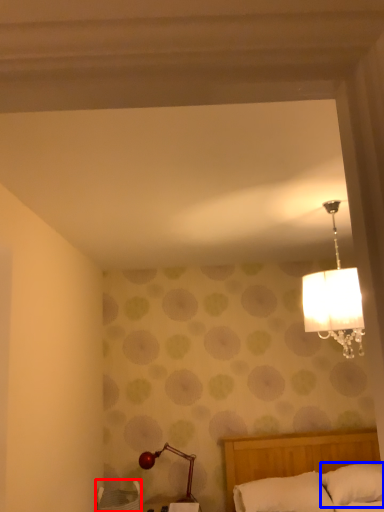
Question: Which point is closer to the camera, furniture (highlighted by a red box) or pillow (highlighted by a blue box)?

Choices:
 (A) furniture
 (B) pillow

Answer: (A)